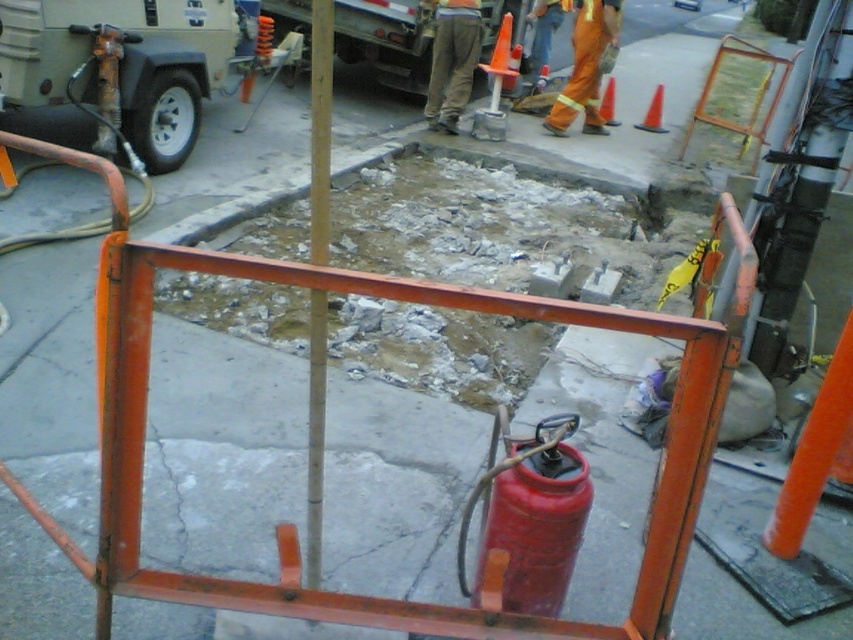
Does orange reflective pants at center appear over orange plastic traffic cone at center?

No.

Which is in front, point (612, 42) or point (503, 74)?

Point (503, 74) is in front.

The width and height of the screenshot is (853, 640). I want to click on orange reflective pants at center, so click(585, 67).

Is the position of white smooth pole at center more distant than that of orange plastic traffic cone at center?

No, white smooth pole at center is in front of orange plastic traffic cone at center.

Who is more forward, (323, 378) or (509, 64)?

Point (323, 378) is more forward.

Between point (325, 321) and point (511, 74), which one is positioned behind?

Positioned behind is point (511, 74).

The width and height of the screenshot is (853, 640). I want to click on white smooth pole at center, so click(320, 128).

The height and width of the screenshot is (640, 853). I want to click on matte red extinguisher at center, so click(x=531, y=515).

Is point (573, 461) less distant than point (518, 52)?

That is True.

This screenshot has height=640, width=853. Identify the location of matte red extinguisher at center. (531, 515).